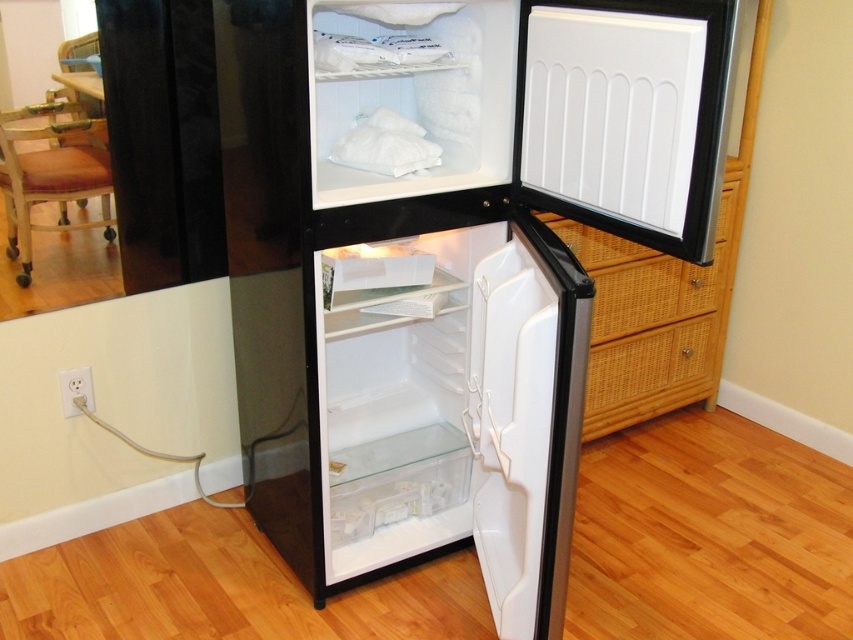
Who is higher up, black glossy refrigerator at center or white matte door at center?

black glossy refrigerator at center

Is point (602, 1) more distant than point (531, 476)?

No, it is in front of (531, 476).

The height and width of the screenshot is (640, 853). Find the location of `black glossy refrigerator at center`. black glossy refrigerator at center is located at coordinates (445, 260).

At what (x,y) coordinates should I click in order to perform the action: click on black glossy refrigerator at center. Please return your answer as a coordinate pair (x, y). This screenshot has width=853, height=640. Looking at the image, I should click on (445, 260).